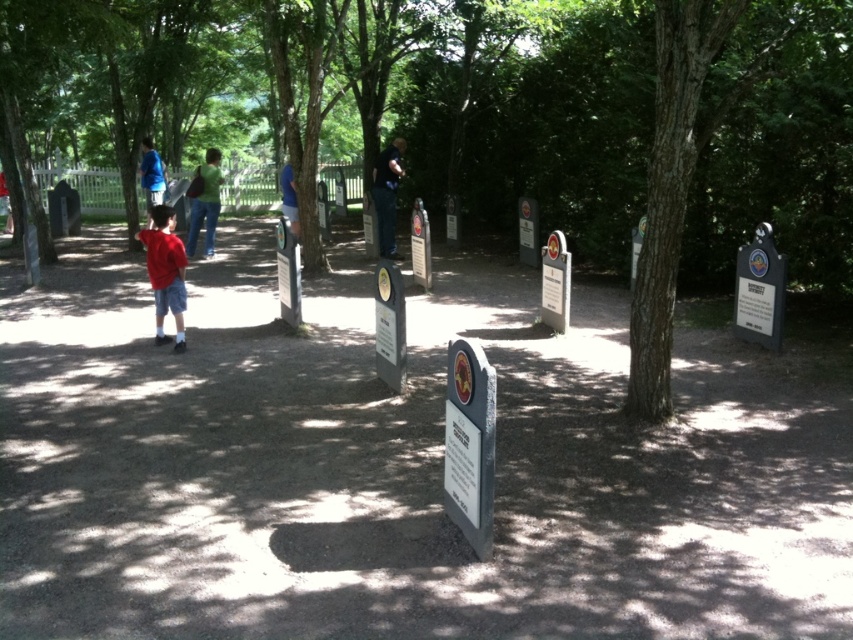
Who is positioned more to the left, blue jeans at center or blue shirt at upper left?

blue shirt at upper left is more to the left.

Is blue jeans at center to the right of blue shirt at upper left from the viewer's perspective?

Indeed, blue jeans at center is positioned on the right side of blue shirt at upper left.

You are a GUI agent. You are given a task and a screenshot of the screen. Output one action in this format:
    pyautogui.click(x=<x>, y=<y>)
    Task: Click on the blue jeans at center
    Image resolution: width=853 pixels, height=640 pixels.
    Given the screenshot: What is the action you would take?
    pyautogui.click(x=387, y=195)

Measure the distance from gray stone markers at center to blue fabric shirt at center.

3.81 meters

Does gray stone markers at center come behind blue fabric shirt at center?

That is False.

This screenshot has width=853, height=640. What do you see at coordinates (395, 467) in the screenshot? I see `gray stone markers at center` at bounding box center [395, 467].

You are a GUI agent. You are given a task and a screenshot of the screen. Output one action in this format:
    pyautogui.click(x=<x>, y=<y>)
    Task: Click on the gray stone markers at center
    
    Given the screenshot: What is the action you would take?
    pyautogui.click(x=395, y=467)

Between green fabric shirt at center and blue fabric shirt at center, which one is positioned higher?

blue fabric shirt at center

Which is more to the right, green fabric shirt at center or blue fabric shirt at center?

blue fabric shirt at center

Who is more distant from viewer, [215,157] or [286,164]?

Point [286,164]

Find the location of a particular element. The height and width of the screenshot is (640, 853). green fabric shirt at center is located at coordinates (206, 204).